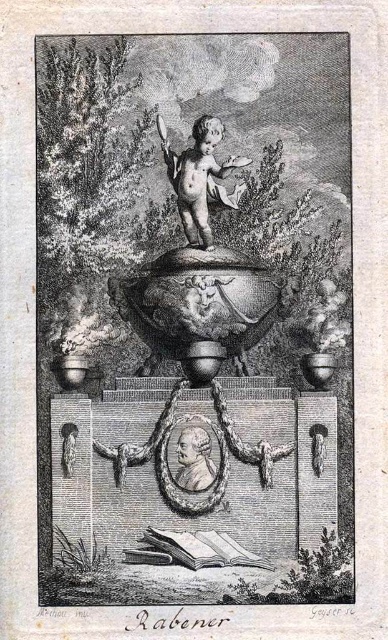
Question: Which point is closer to the camera?

Choices:
 (A) smooth bronze cherub at center
 (B) etched bronze urn at center

Answer: (B)

Question: Can you confirm if etched bronze urn at center is bigger than smooth bronze cherub at center?

Choices:
 (A) yes
 (B) no

Answer: (A)

Question: Can you confirm if etched bronze urn at center is bigger than smooth bronze cherub at center?

Choices:
 (A) yes
 (B) no

Answer: (A)

Question: Where is etched bronze urn at center located in relation to smooth bronze cherub at center in the image?

Choices:
 (A) right
 (B) left

Answer: (B)

Question: Which object appears farthest from the camera in this image?

Choices:
 (A) etched bronze urn at center
 (B) smooth bronze cherub at center

Answer: (B)